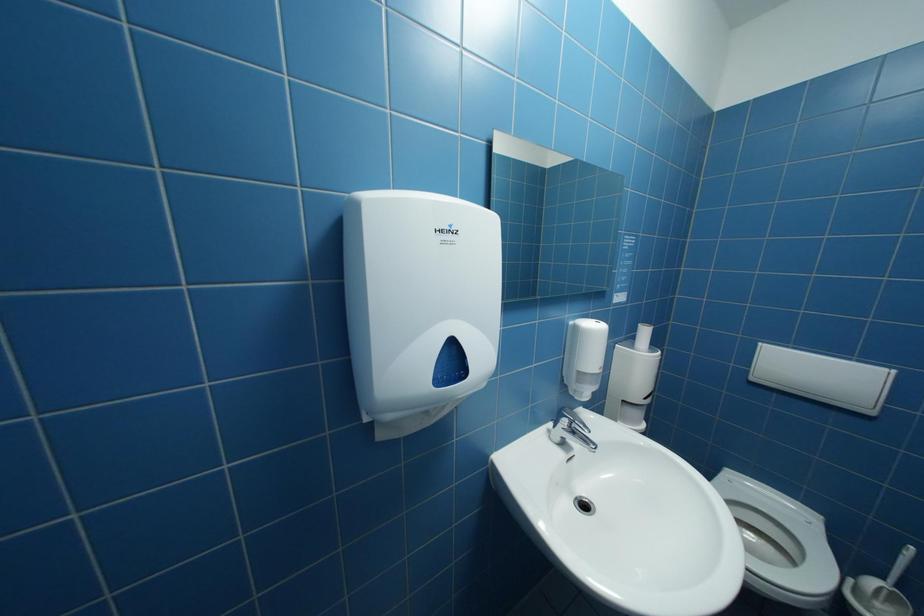
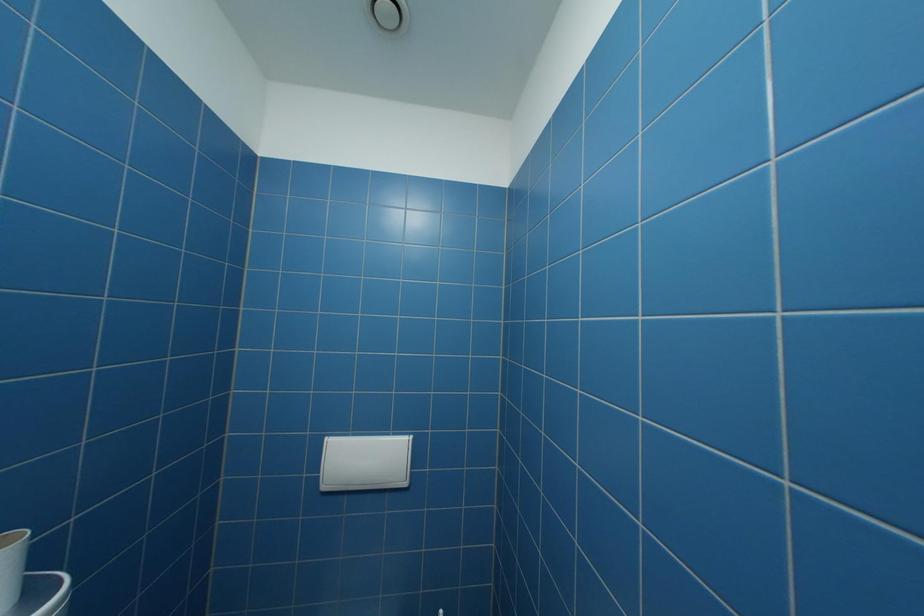
Question: The camera is either moving clockwise (left) or counter-clockwise (right) around the object. The first image is from the beginning of the video and the second image is from the end. Is the camera moving left or right when shooting the video?

Choices:
 (A) Left
 (B) Right

Answer: (A)